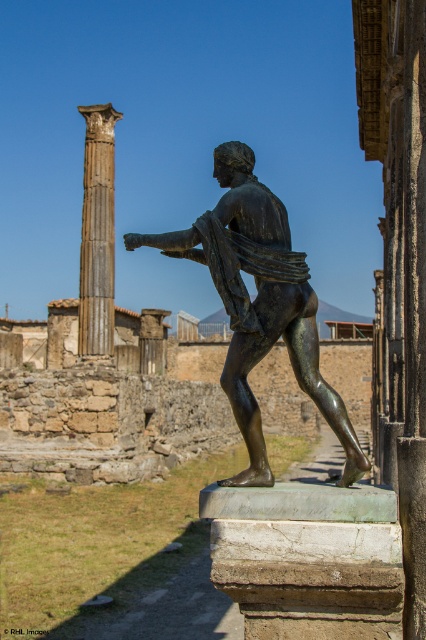
Question: Which object appears farthest from the camera in this image?

Choices:
 (A) bronze statue at center
 (B) bronze column at left

Answer: (B)

Question: Which of the following is the closest to the observer?

Choices:
 (A) (201, 259)
 (B) (109, 282)

Answer: (A)

Question: Which of the following is the closest to the observer?

Choices:
 (A) bronze statue at center
 (B) bronze column at left

Answer: (A)

Question: Considering the relative positions of bronze statue at center and bronze column at left in the image provided, where is bronze statue at center located with respect to bronze column at left?

Choices:
 (A) right
 (B) left

Answer: (A)

Question: Is bronze statue at center positioned before bronze column at left?

Choices:
 (A) yes
 (B) no

Answer: (A)

Question: From the image, what is the correct spatial relationship of bronze statue at center in relation to bronze column at left?

Choices:
 (A) below
 (B) above

Answer: (A)